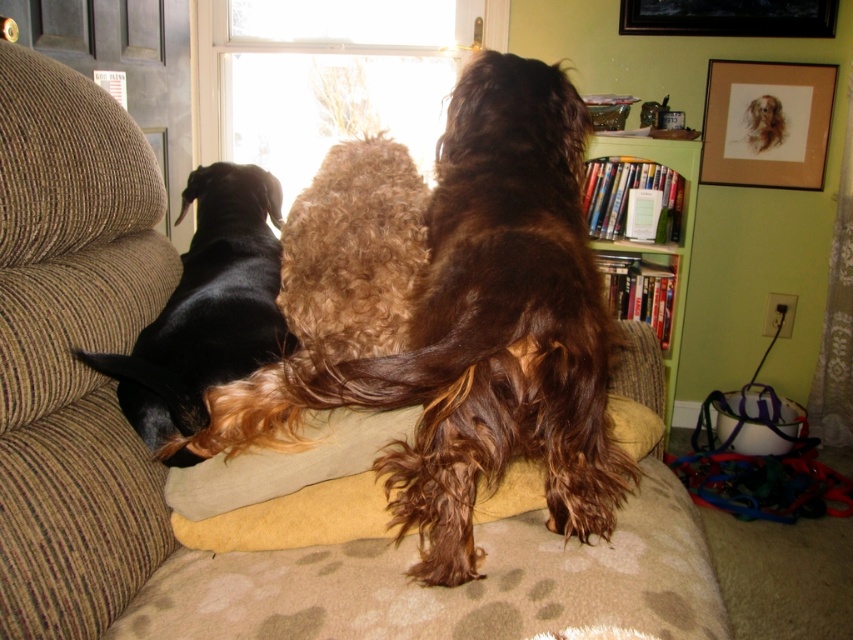
You are a dog trainer who needs to place a treat between the brown curly fur dog at center and the black shiny dog at left. Can you fit a treat that is 12 inches long between them?

The distance between the brown curly fur dog at center and the black shiny dog at left is 15.62 inches. Since the treat is 12 inches long, it can fit between them as there is enough space.

You are standing in the room and want to place a small plant on the couch where there is space between the black shiny dog at left and the light colored throw pillow in front. Can you determine if the point marked at coordinates (207, 307) is a suitable spot for placing the plant?

The point marked at coordinates (207, 307) is on the black shiny dog at left, so placing the plant there would not be suitable as it is occupied by the dog.